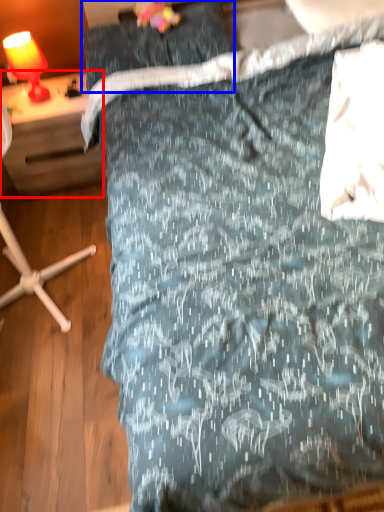
Question: Which point is further to the camera, desk (highlighted by a red box) or pillow (highlighted by a blue box)?

Choices:
 (A) desk
 (B) pillow

Answer: (A)